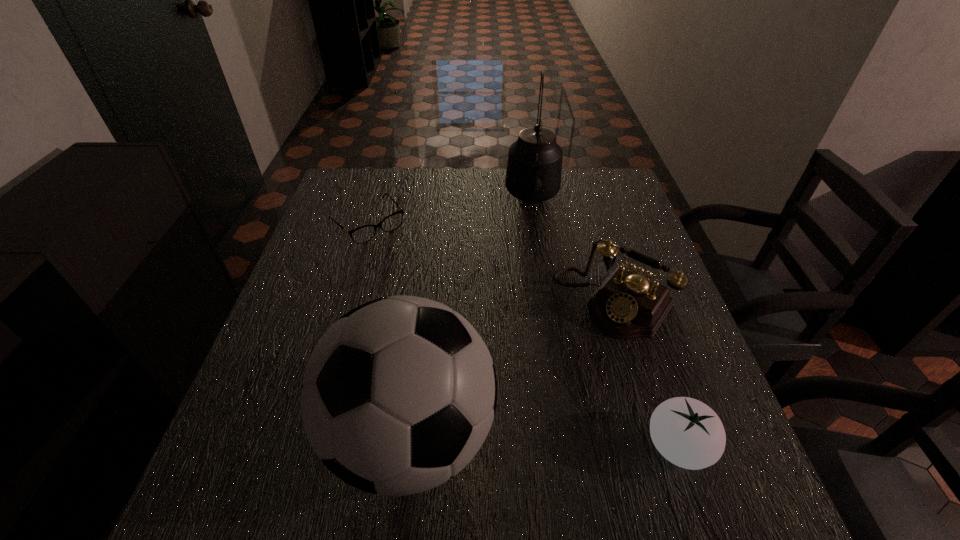
This screenshot has height=540, width=960. What are the coordinates of `vacant space at the far left corner of the desktop` in the screenshot? It's located at (374, 192).

Where is `free space at the far right corner of the desktop`? The width and height of the screenshot is (960, 540). free space at the far right corner of the desktop is located at coordinates (598, 171).

This screenshot has height=540, width=960. In order to click on free area in between the fourth tallest object and the fourth shortest object in this screenshot , I will do (545, 441).

What are the coordinates of `unoccupied position between the soccer ball and the kettle` in the screenshot? It's located at (472, 316).

Identify the location of vacant space in between the shortest object and the third nearest object. (492, 263).

Locate an element on the screen. This screenshot has height=540, width=960. free space between the spectacles and the tallest object is located at coordinates (450, 211).

Where is `empty space that is in between the fourth shortest object and the tomato`? The image size is (960, 540). empty space that is in between the fourth shortest object and the tomato is located at coordinates (545, 441).

The image size is (960, 540). I want to click on free space between the spectacles and the tallest object, so click(x=450, y=211).

You are a GUI agent. You are given a task and a screenshot of the screen. Output one action in this format:
    pyautogui.click(x=<x>, y=<y>)
    Task: Click on the free space that is in between the shortest object and the kettle
    The height and width of the screenshot is (540, 960).
    Given the screenshot: What is the action you would take?
    pyautogui.click(x=450, y=211)

At what (x,y) coordinates should I click in order to perform the action: click on empty location between the kettle and the spectacles. Please return your answer as a coordinate pair (x, y). Looking at the image, I should click on (450, 211).